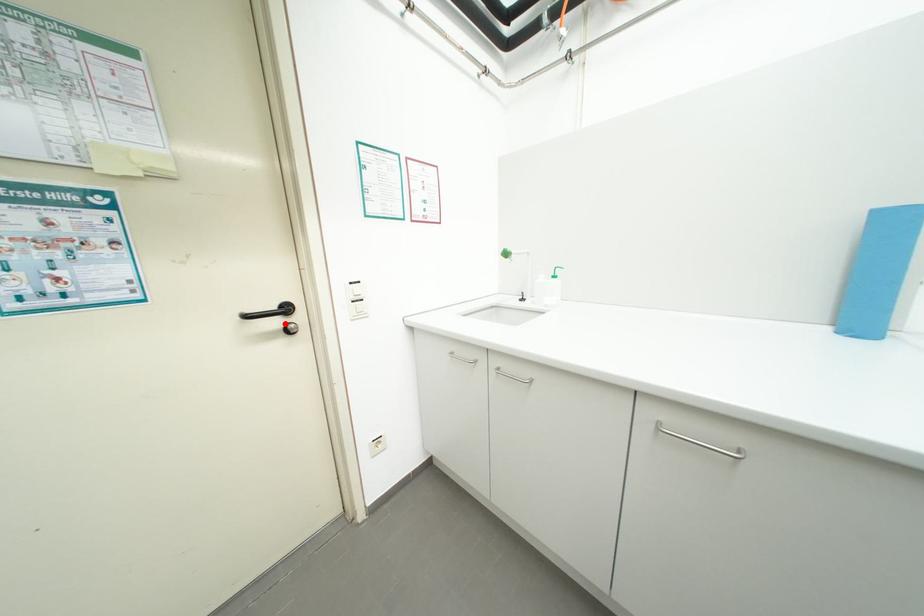
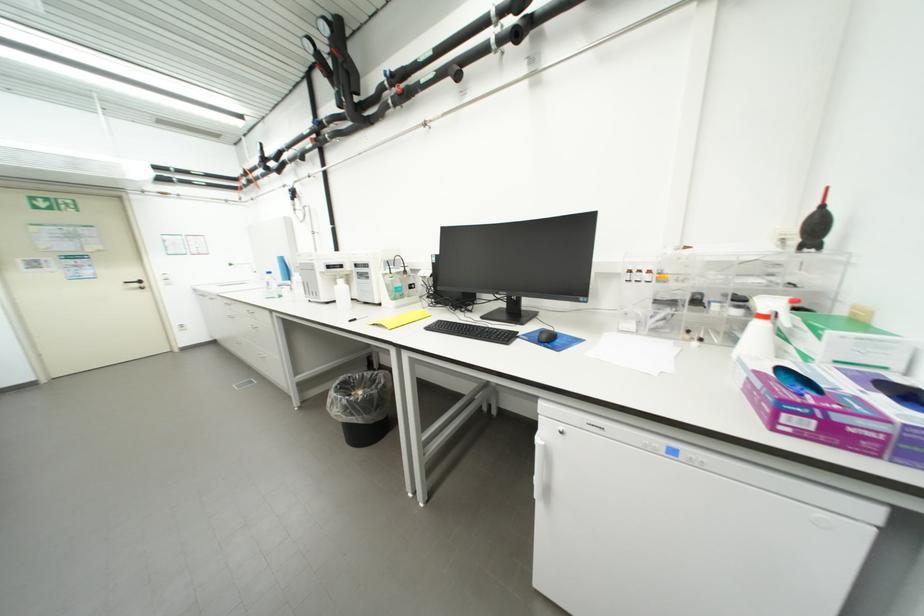
Find the pixel in the second image that matches the highlighted location in the first image.

(144, 286)